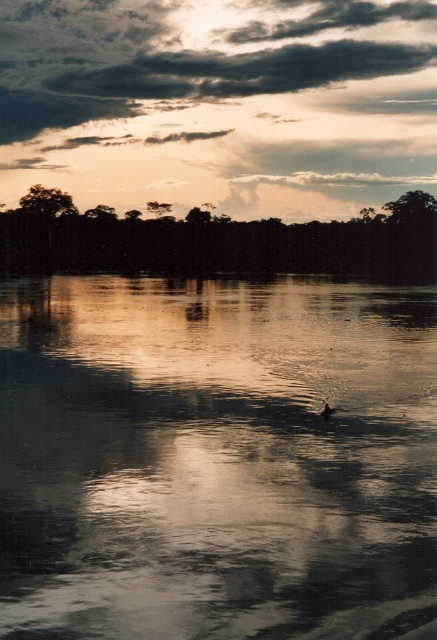
You are an observer standing at the edge of the water. You see the silvery reflective water at center and the brown matte duck at center. Which object is higher in the scene?

The silvery reflective water at center is much taller than the brown matte duck at center.

You are standing on the edge of the water in the image. You see a point at coordinates (215, 458). What is located at that point?

The point at coordinates (215, 458) corresponds to silvery reflective water at center.

You are standing on the shore of the serene scene and want to toss a small pebble into the silvery reflective water at center. If the brown matte duck at center is currently 10.10 meters away from you, will your pebble reach the water before the duck swims away? Assume the duck swims at 0.5 meters per second and you can throw the pebble 8 meters per second.

The silvery reflective water at center is 10.10 meters from brown matte duck at center. If the duck is 10.10 meters away from you, then the water is also 10.10 meters away. The pebble travels at 8 mps, so it takes 1.26 seconds to reach the water. The duck swims at 0.5 mps, so in 1.26 seconds, it moves 0.63 meters. Since the duck needs to cover the full 10.10 meters to escape, the pebble will reach the water before the duck swims away.